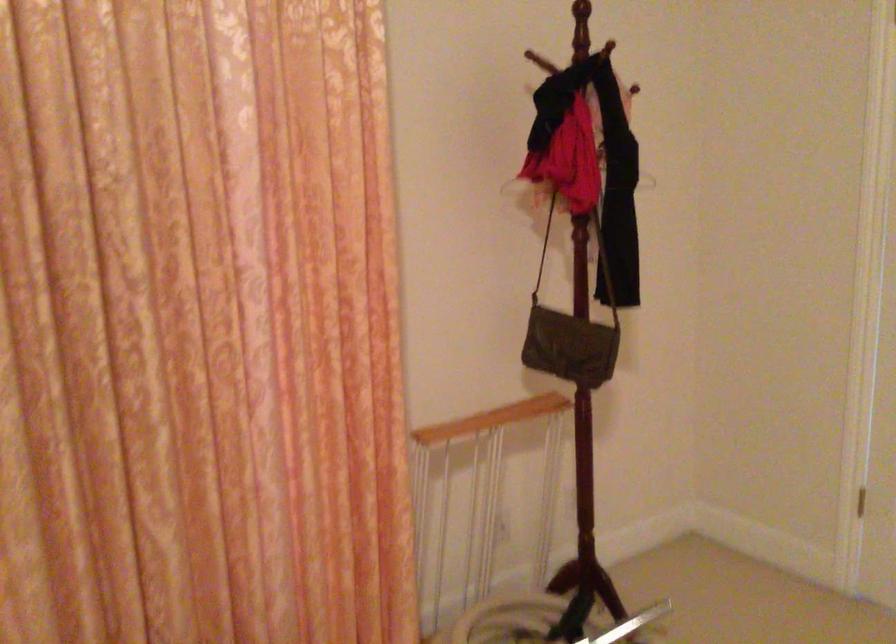
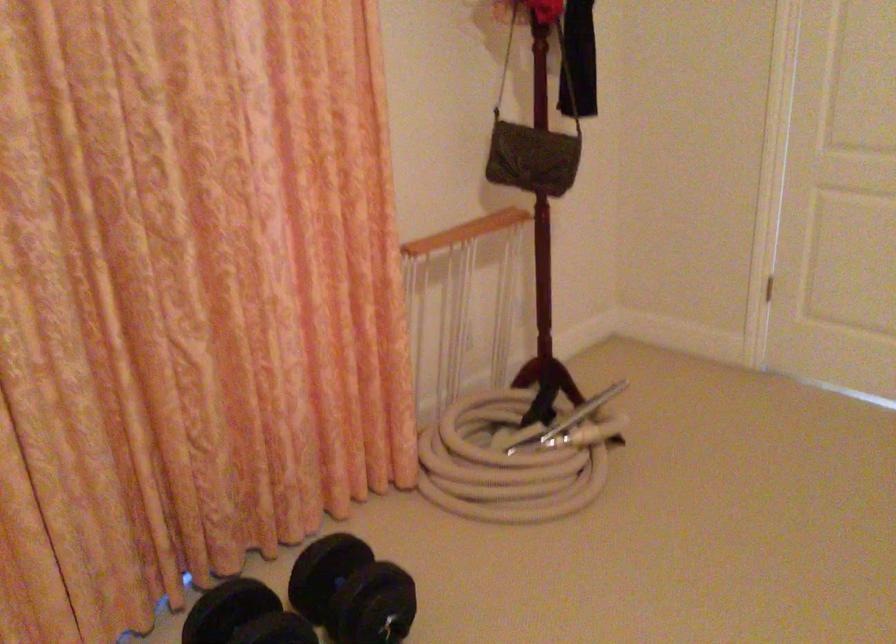
Find the pixel in the second image that matches point 567,346 in the first image.

(531, 158)